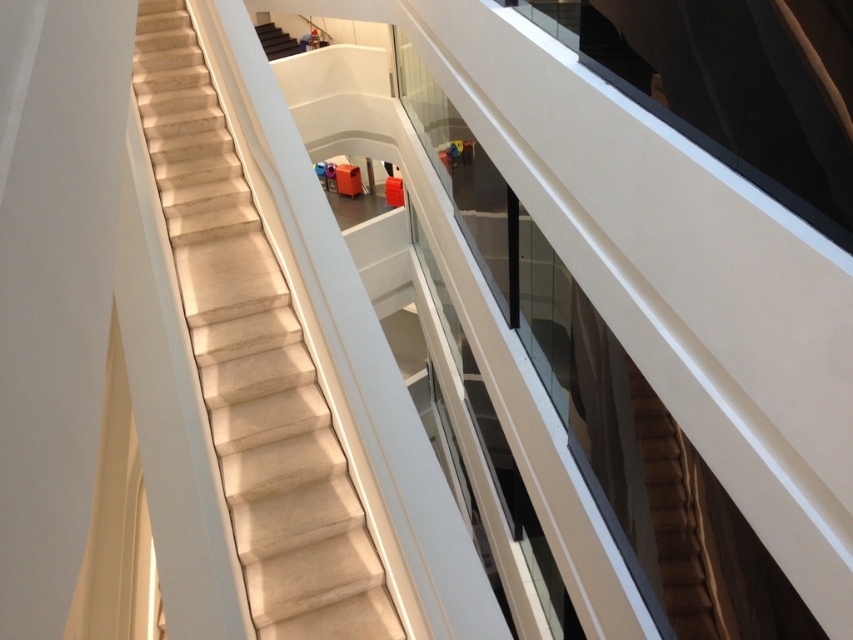
Question: Can you confirm if white marble stairs at center is positioned below smooth beige stairs at upper center?

Choices:
 (A) yes
 (B) no

Answer: (A)

Question: Where is white marble stairs at center located in relation to smooth beige stairs at upper center in the image?

Choices:
 (A) above
 (B) below

Answer: (B)

Question: Which of the following is the farthest from the observer?

Choices:
 (A) smooth beige stairs at upper center
 (B) white marble stairs at center

Answer: (A)

Question: Can you confirm if white marble stairs at center is positioned to the right of smooth beige stairs at upper center?

Choices:
 (A) no
 (B) yes

Answer: (B)

Question: Which of the following is the closest to the observer?

Choices:
 (A) smooth beige stairs at upper center
 (B) white marble stairs at center

Answer: (B)